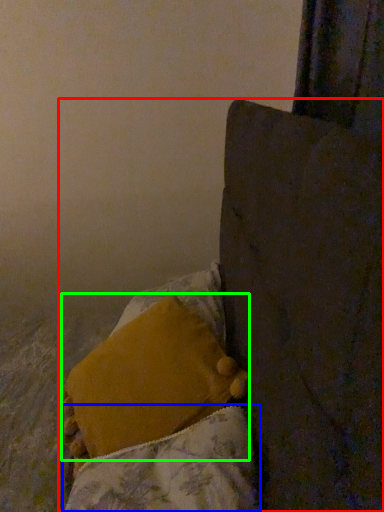
Question: Estimate the real-world distances between objects in this image. Which object is closer to furniture (highlighted by a red box), blanket (highlighted by a blue box) or pillow (highlighted by a green box)?

Choices:
 (A) blanket
 (B) pillow

Answer: (A)